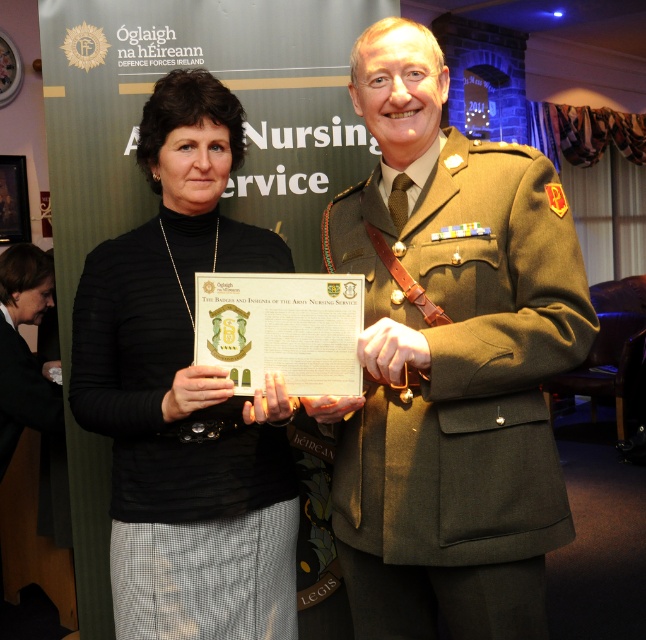
Question: Does matte olive-green uniform at center lie in front of black matte card at center?

Choices:
 (A) no
 (B) yes

Answer: (B)

Question: Among these points, which one is nearest to the camera?

Choices:
 (A) (171, 468)
 (B) (470, 449)

Answer: (B)

Question: Which object appears farthest from the camera in this image?

Choices:
 (A) matte olive-green uniform at center
 (B) black matte card at center

Answer: (B)

Question: Can you confirm if matte olive-green uniform at center is positioned to the right of black matte card at center?

Choices:
 (A) no
 (B) yes

Answer: (B)

Question: Where is matte olive-green uniform at center located in relation to black matte card at center in the image?

Choices:
 (A) above
 (B) below

Answer: (A)